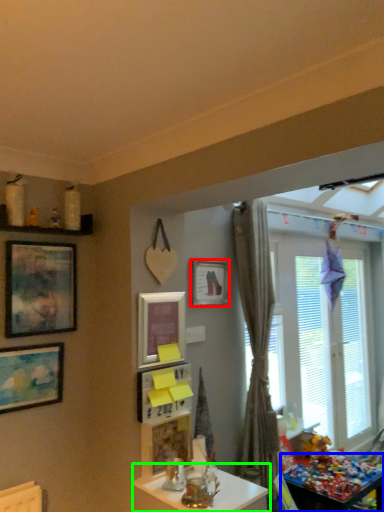
Question: Which object is the closest to the picture frame (highlighted by a red box)? Choose among these: table (highlighted by a blue box) or table (highlighted by a green box).

Choices:
 (A) table
 (B) table

Answer: (B)